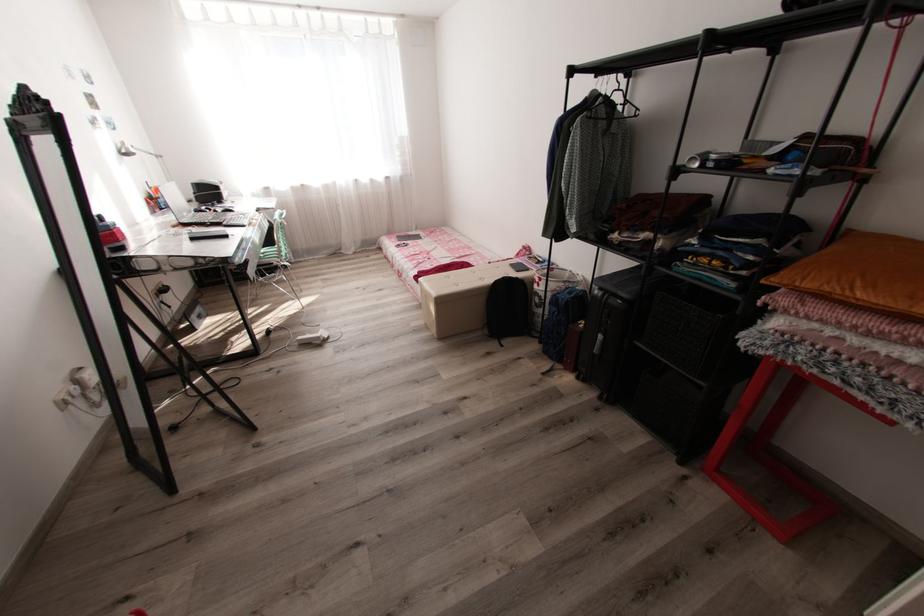
The location [207,233] corresponds to which object?

It refers to a black smartphone.